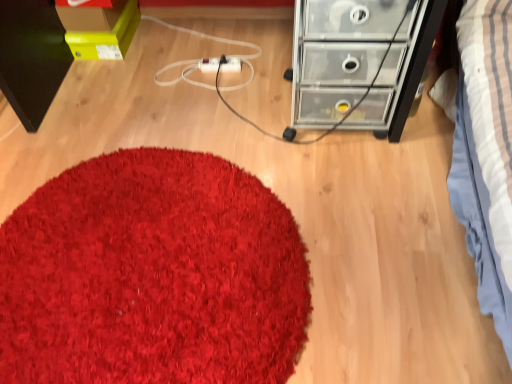
Locate an element on the screen. Image resolution: width=512 pixels, height=384 pixels. free space that is to the left of white plastic extension cord at center is located at coordinates (182, 69).